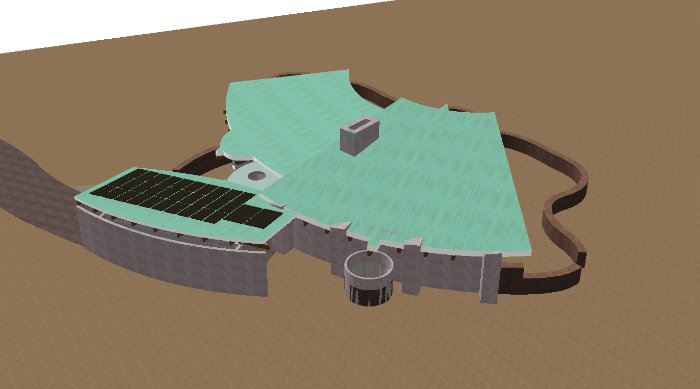
Identify the location of marks on front gray wall. The width and height of the screenshot is (700, 389). (453, 257), (425, 254), (397, 247), (370, 253), (351, 237), (325, 230), (304, 222).